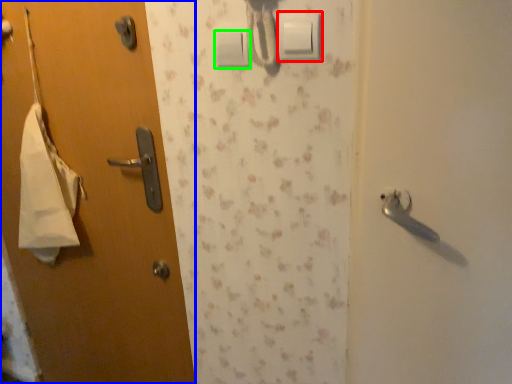
Question: Considering the real-world distances, which object is farthest from light switch (highlighted by a red box)? door (highlighted by a blue box) or light switch (highlighted by a green box)?

Choices:
 (A) door
 (B) light switch

Answer: (A)